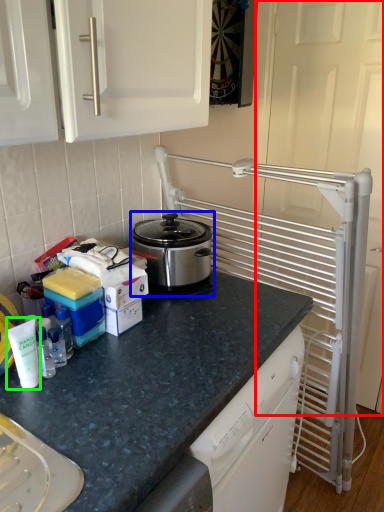
Question: Which is nearer to the screen door (highlighted by a red box)? kitchen appliance (highlighted by a blue box) or bottle (highlighted by a green box).

Choices:
 (A) kitchen appliance
 (B) bottle

Answer: (A)